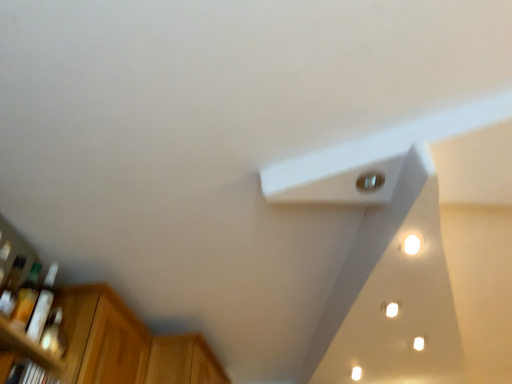
Question: Looking at the image, does wooden cabinet at lower left seem bigger or smaller compared to translucent plastic bottle at left, the 3th bottle when ordered from front to back?

Choices:
 (A) small
 (B) big

Answer: (B)

Question: Looking at their shapes, would you say wooden cabinet at lower left is wider or thinner than translucent plastic bottle at left, the 3th bottle when ordered from front to back?

Choices:
 (A) wide
 (B) thin

Answer: (A)

Question: Estimate the real-world distances between objects in this image. Which object is farther from the metallic silver light at upper right, which is the second light in bottom-to-top order?

Choices:
 (A) white glossy light at upper right, arranged as the 1th light when viewed from the right
 (B) translucent glass bottle at left, marked as the 1th bottle in a front-to-back arrangement
 (C) translucent plastic bottle at left, the 3th bottle when ordered from front to back
 (D) wooden cabinet at lower left
 (E) white matte exhaust hood at upper center

Answer: (D)

Question: Based on their relative distances, which object is farther from the metallic silver light at upper right, which is the second light in bottom-to-top order?

Choices:
 (A) translucent plastic bottle at left, the 1th bottle from the back
 (B) wooden cabinet at lower left
 (C) translucent glass bottle at left, marked as the 1th bottle in a front-to-back arrangement
 (D) translucent glass bottle at lower left, which appears as the 2th bottle when viewed from the front
 (E) white glossy light at upper right, arranged as the second light when viewed from the left

Answer: (B)